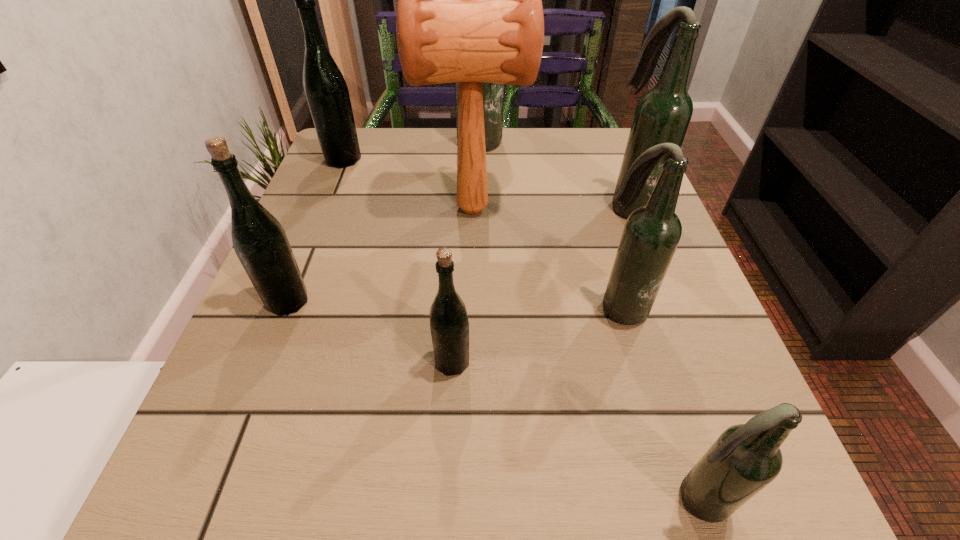
The width and height of the screenshot is (960, 540). Find the location of `the biggest dark beer bottle`. the biggest dark beer bottle is located at coordinates (493, 93).

At what (x,y) coordinates should I click in order to perform the action: click on the leftmost dark beer bottle. Please return your answer as a coordinate pair (x, y). This screenshot has height=540, width=960. Looking at the image, I should click on (493, 93).

Identify the location of mallet. (469, 10).

The image size is (960, 540). What are the coordinates of `the biggest green beer bottle` in the screenshot? It's located at (326, 91).

The height and width of the screenshot is (540, 960). Find the location of `the third farthest beer bottle`. the third farthest beer bottle is located at coordinates (663, 113).

This screenshot has width=960, height=540. In order to click on the third nearest dark beer bottle in this screenshot , I will do `click(663, 113)`.

The image size is (960, 540). I want to click on the second biggest green beer bottle, so click(x=259, y=240).

Find the location of a particular element. The height and width of the screenshot is (540, 960). the second smallest dark beer bottle is located at coordinates (651, 234).

Locate an element on the screen. the second nearest object is located at coordinates (449, 325).

At what (x,y) coordinates should I click in order to perform the action: click on the smallest green beer bottle. Please return your answer as a coordinate pair (x, y). The width and height of the screenshot is (960, 540). Looking at the image, I should click on (449, 325).